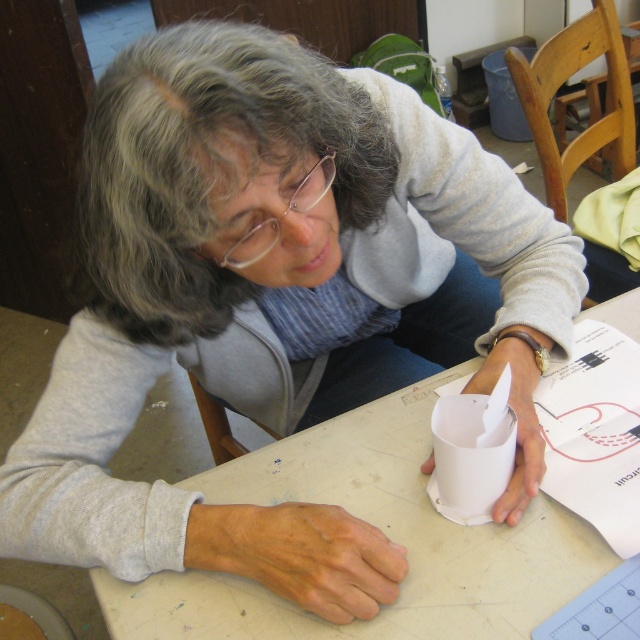
Question: Does gray matte hair at upper center have a lesser width compared to white paper at center?

Choices:
 (A) yes
 (B) no

Answer: (A)

Question: Which point is farther from the camera taking this photo?

Choices:
 (A) (147, 84)
 (B) (628, 500)
 (C) (628, 310)

Answer: (C)

Question: Which of these objects is positioned farthest from the white paper at lower right?

Choices:
 (A) gray matte hair at upper center
 (B) white paper at center

Answer: (A)

Question: Is white paper at center to the left of white paper at lower right from the viewer's perspective?

Choices:
 (A) no
 (B) yes

Answer: (B)

Question: Estimate the real-world distances between objects in this image. Which object is farther from the white paper at center?

Choices:
 (A) gray matte hair at upper center
 (B) white paper at lower right

Answer: (A)

Question: Is gray matte hair at upper center to the right of white paper at center from the viewer's perspective?

Choices:
 (A) yes
 (B) no

Answer: (B)